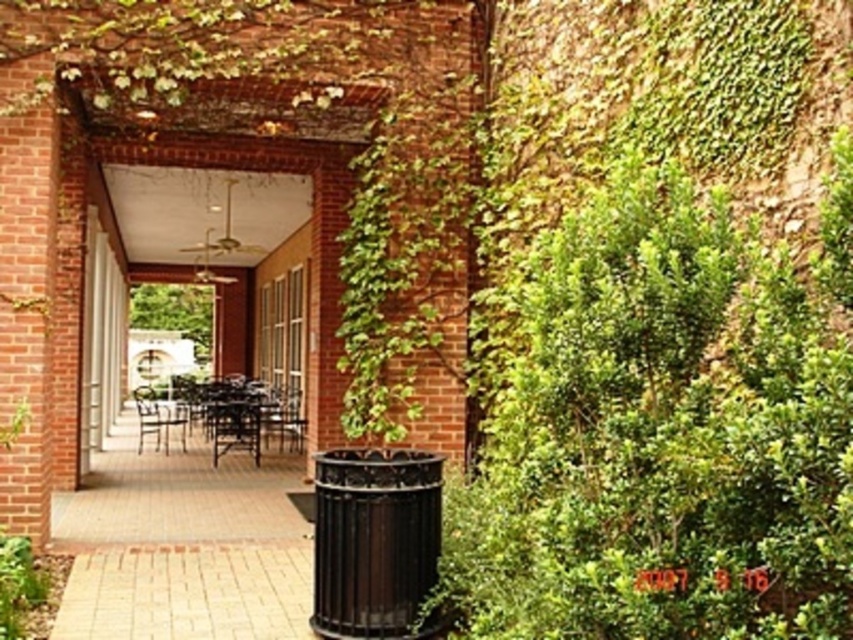
Question: Which point is farther to the camera?

Choices:
 (A) (178, 419)
 (B) (303, 432)
 (C) (227, 433)

Answer: (A)

Question: Estimate the real-world distances between objects in this image. Which object is farther from the wooden chair at center?

Choices:
 (A) metallic black chair at center
 (B) metallic brown chair at center

Answer: (B)

Question: Which is nearer to the metallic brown chair at center?

Choices:
 (A) wooden chair at center
 (B) metallic black chair at center

Answer: (A)

Question: Can you confirm if wooden chair at center is wider than metallic black chair at center?

Choices:
 (A) no
 (B) yes

Answer: (B)

Question: Is wooden chair at center thinner than metallic brown chair at center?

Choices:
 (A) no
 (B) yes

Answer: (B)

Question: In this image, where is wooden chair at center located relative to metallic brown chair at center?

Choices:
 (A) left
 (B) right

Answer: (B)